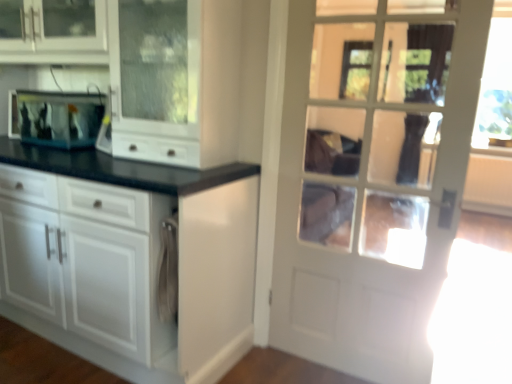
What do you see at coordinates (128, 259) in the screenshot?
I see `white glossy cabinet at center` at bounding box center [128, 259].

Where is `clear glass fish tank at left`? This screenshot has width=512, height=384. clear glass fish tank at left is located at coordinates (56, 118).

Does clear glass fish tank at left have a lesser height compared to white glossy cabinet at center?

Correct, clear glass fish tank at left is not as tall as white glossy cabinet at center.

How much distance is there between clear glass fish tank at left and white glossy cabinet at center?

They are 27.98 inches apart.

From a real-world perspective, which object stands above the other?

In real-world perspective, clear glass fish tank at left is above.

From a real-world perspective, is white glossy cabinet at center positioned above or below clear glass fish tank at left?

white glossy cabinet at center is situated lower than clear glass fish tank at left in the real world.

Is point (117, 167) closer or farther from the camera than point (42, 129)?

Clearly, point (117, 167) is closer to the camera than point (42, 129).

Could you tell me if white glossy cabinet at center is turned towards clear glass fish tank at left?

Yes, white glossy cabinet at center is turned towards clear glass fish tank at left.

Is white glossy cabinet at center placed right next to clear glass fish tank at left?

No, white glossy cabinet at center is not in contact with clear glass fish tank at left.

From a real-world perspective, who is located higher, white glass door at upper right or clear glass fish tank at left?

From a 3D spatial view, clear glass fish tank at left is above.

Does white glass door at upper right have a smaller size compared to clear glass fish tank at left?

Incorrect, white glass door at upper right is not smaller in size than clear glass fish tank at left.

Locate an element on the screen. This screenshot has width=512, height=384. appliance that appears behind the white glass door at upper right is located at coordinates (56, 118).

Are clear glass fish tank at left and white glass door at upper right making contact?

clear glass fish tank at left is not next to white glass door at upper right, and they're not touching.

I want to click on appliance above the white glass door at upper right (from the image's perspective), so click(x=56, y=118).

Can you confirm if clear glass fish tank at left is taller than white glass door at upper right?

No, clear glass fish tank at left is not taller than white glass door at upper right.

Is point (93, 122) positioned behind point (311, 324)?

Yes.

Could you tell me if white glossy cabinet at center is facing white glass door at upper right?

No, white glossy cabinet at center is not turned towards white glass door at upper right.

How far apart are white glossy cabinet at center and white glass door at upper right?

white glossy cabinet at center is 26.01 inches away from white glass door at upper right.

Does white glossy cabinet at center have a lesser height compared to white glass door at upper right?

In fact, white glossy cabinet at center may be taller than white glass door at upper right.

Considering the points (153, 217) and (377, 9), which point is in front, point (153, 217) or point (377, 9)?

Positioned in front is point (153, 217).

Which point is more forward, (366, 169) or (216, 292)?

The point (366, 169) is closer.

Considering the relative positions of white glass door at upper right and white glossy cabinet at center in the image provided, is white glass door at upper right to the left or to the right of white glossy cabinet at center?

Clearly, white glass door at upper right is on the right of white glossy cabinet at center in the image.

Can we say white glass door at upper right lies outside white glossy cabinet at center?

That's correct, white glass door at upper right is outside of white glossy cabinet at center.

Is white glass door at upper right aimed at white glossy cabinet at center?

No.

Find the location of a particular element. The height and width of the screenshot is (384, 512). appliance that appears above the white glossy cabinet at center (from a real-world perspective) is located at coordinates (56, 118).

The image size is (512, 384). In order to click on cabinetry that appears below the clear glass fish tank at left (from the image's perspective) in this screenshot , I will do `click(128, 259)`.

Which object lies further to the anchor point clear glass fish tank at left, white glossy cabinet at center or white glass door at upper right?

Based on the image, white glass door at upper right appears to be further to clear glass fish tank at left.

Based on their spatial positions, is white glossy cabinet at center or clear glass fish tank at left closer to white glass door at upper right?

white glossy cabinet at center lies closer to white glass door at upper right than the other object.

Looking at this image, from the image, which object appears to be nearer to white glossy cabinet at center, white glass door at upper right or clear glass fish tank at left?

white glass door at upper right is closer to white glossy cabinet at center.

Considering their positions, is clear glass fish tank at left positioned further to white glass door at upper right than white glossy cabinet at center?

clear glass fish tank at left lies further to white glass door at upper right than the other object.

Consider the image. From the image, which object appears to be farther from clear glass fish tank at left, white glass door at upper right or white glossy cabinet at center?

white glass door at upper right lies further to clear glass fish tank at left than the other object.

From the image, which object appears to be nearer to white glossy cabinet at center, clear glass fish tank at left or white glass door at upper right?

Based on the image, white glass door at upper right appears to be nearer to white glossy cabinet at center.

Where is `appliance located between white glossy cabinet at center and white glass door at upper right in the left-right direction`? appliance located between white glossy cabinet at center and white glass door at upper right in the left-right direction is located at coordinates (56, 118).